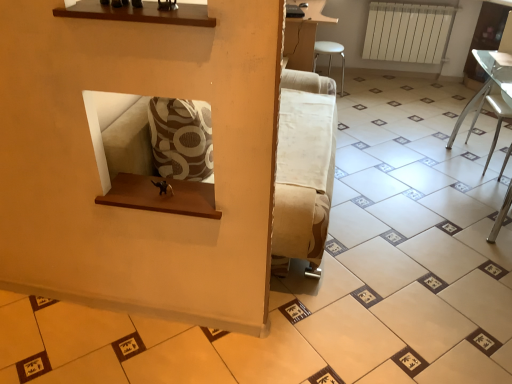
At what (x,y) coordinates should I click in order to perform the action: click on vacant point above white matte radiator at upper right (from a real-world perspective). Please return your answer as a coordinate pair (x, y). Looking at the image, I should click on (416, 3).